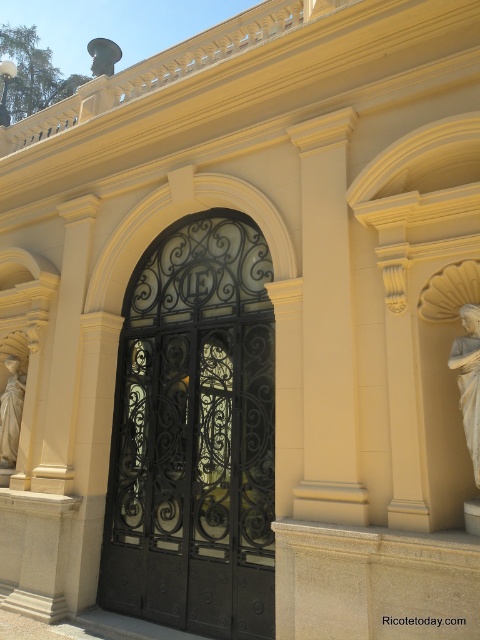
Question: Can you confirm if black wrought iron gate at center is wider than smooth cream stone column at center?

Choices:
 (A) yes
 (B) no

Answer: (A)

Question: Is smooth cream stone column at center positioned at the back of white marble statue at left?

Choices:
 (A) no
 (B) yes

Answer: (A)

Question: Estimate the real-world distances between objects in this image. Which object is farther from the white marble statue at right?

Choices:
 (A) smooth cream stone column at center
 (B) smooth cream stone column at left
 (C) black wrought iron gate at center
 (D) white marble statue at left

Answer: (D)

Question: Which point appears closest to the camera in this image?

Choices:
 (A) (14, 461)
 (B) (79, 353)
 (C) (322, 401)

Answer: (C)

Question: Which object is the closest to the white marble statue at right?

Choices:
 (A) smooth cream stone column at center
 (B) black wrought iron gate at center
 (C) smooth cream stone column at left
 (D) white marble statue at left

Answer: (A)

Question: Is black wrought iron gate at center below smooth cream stone column at left?

Choices:
 (A) no
 (B) yes

Answer: (B)